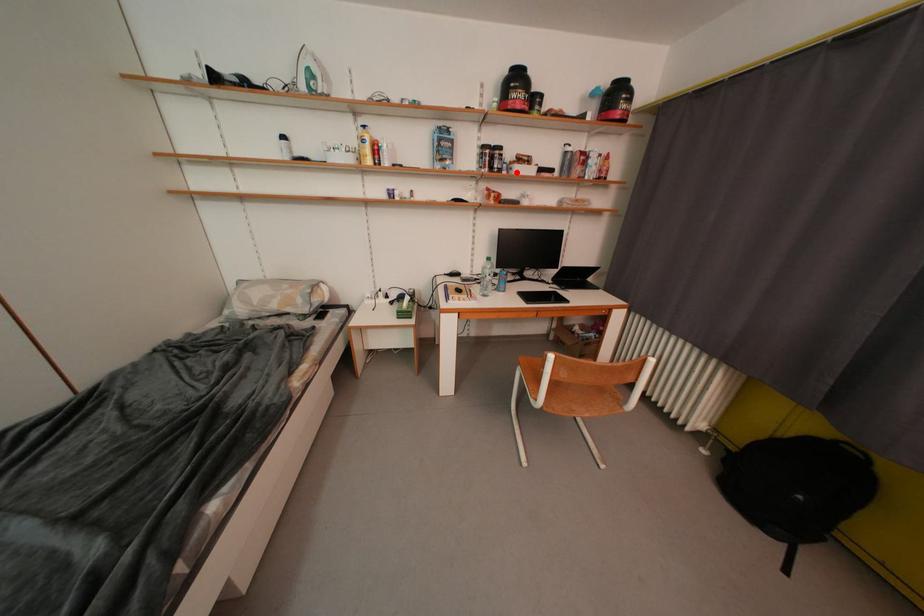
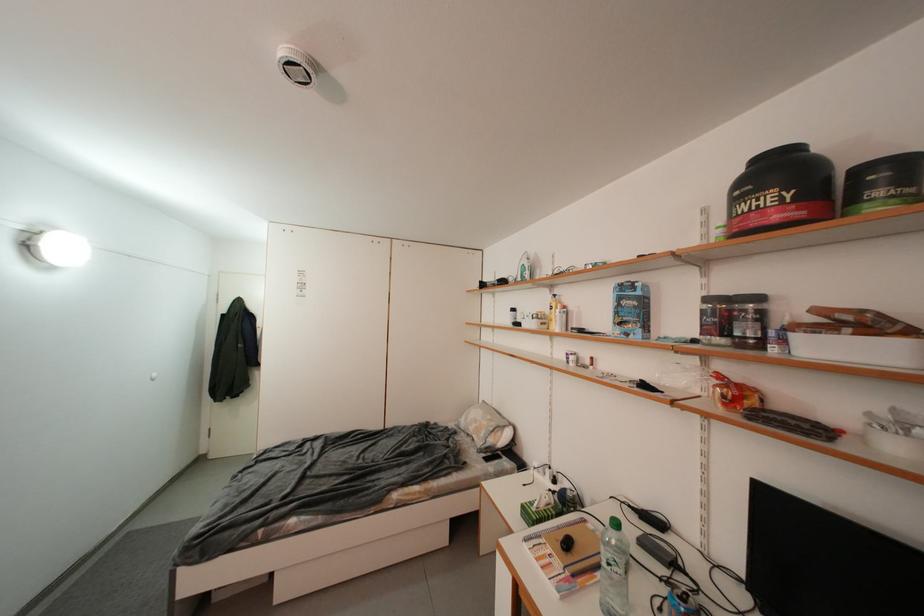
Question: I am providing you with two images of the same scene from different viewpoints. In image1, a red point is highlighted. Considering the same 3D point in image2, which of the following is correct?

Choices:
 (A) It is closer
 (B) It is farther

Answer: (B)